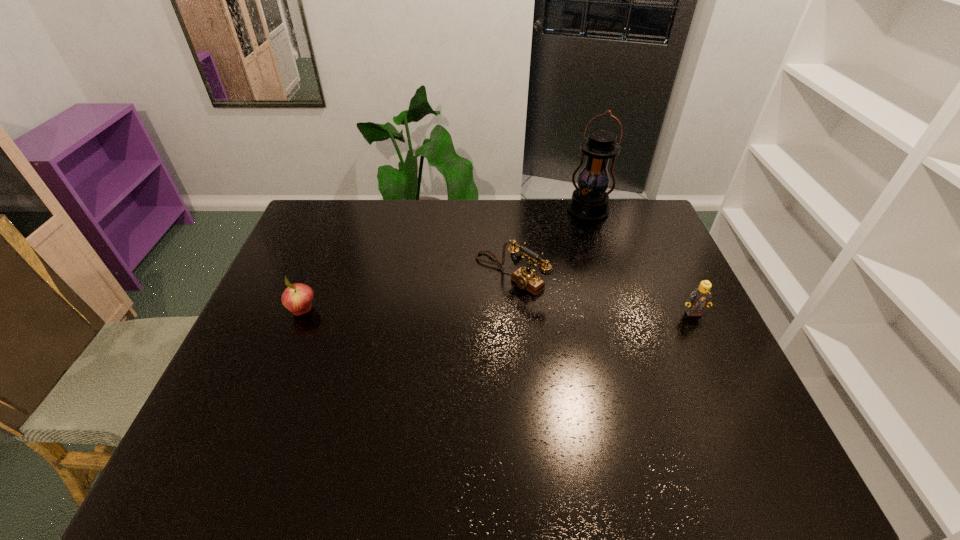
Where is `free space on the desktop that is between the leftmost object and the Lego and is positioned on the front-facing side of the telephone`? free space on the desktop that is between the leftmost object and the Lego and is positioned on the front-facing side of the telephone is located at coordinates (457, 312).

Locate an element on the screen. This screenshot has width=960, height=540. vacant spot on the desktop that is between the leftmost object and the Lego and is positioned above the tallest object, indicating its light source is located at coordinates (546, 312).